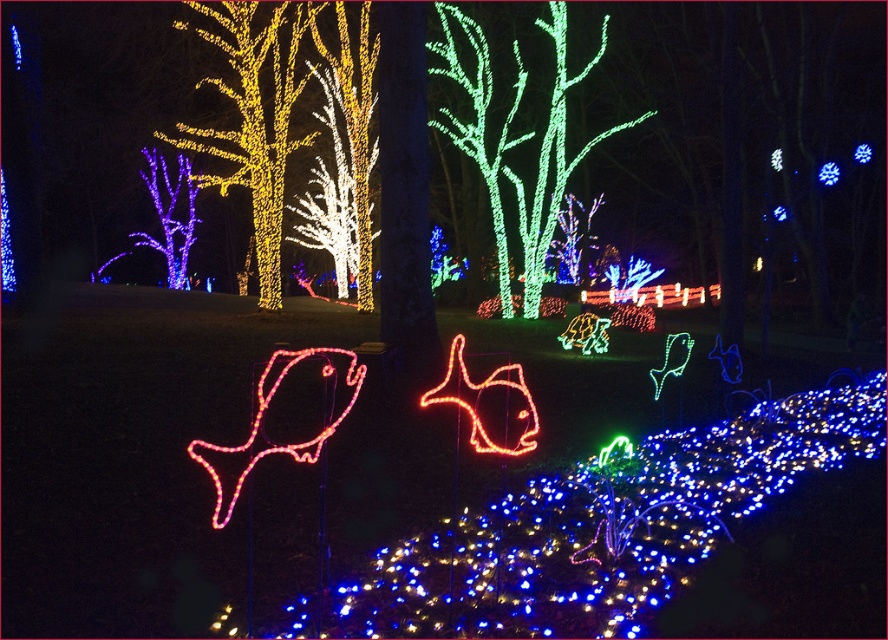
You are standing in the festive outdoor scene and want to walk from one point to another. Which point, point (169, 236) or point (831, 170), is closer to you?

Point (169, 236) is closer to you because it is further to the viewer than point (831, 170).

You are standing at the center of the park and want to find the purple illuminated tree at upper left. What are the coordinates of the tree?

The coordinates of the purple illuminated tree at upper left are point (x=170, y=214).

You are planning to take a photo of the green illuminated tree at center and the blue led lights at center for a night photography class. Considering their sizes, which object should you focus on first to ensure both are in the frame without needing to adjust your camera angle?

The green illuminated tree at center is bigger than the blue led lights at center, so you should focus on the green illuminated tree at center first to ensure both fit in the frame since it takes up more space.